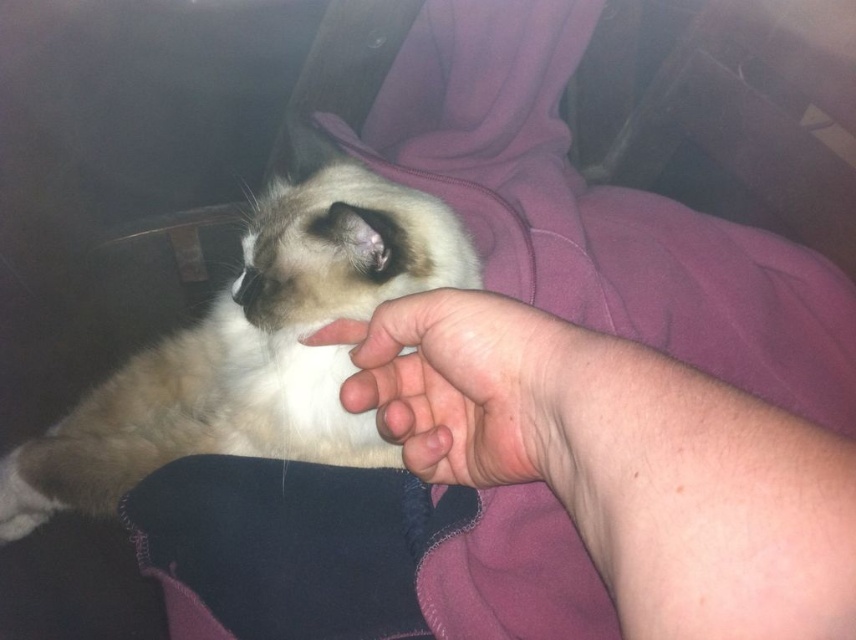
You are sitting in the backseat of a car at night and see two points in the scene. The first point is labeled as point (351,333) and the second is point (364,214). Which point is closer to you?

Point (351,333) is closer to you because it is further to the viewer than point (364,214).